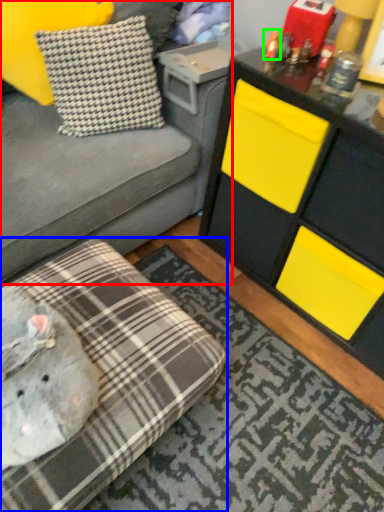
Question: Based on their relative distances, which object is farther from studio couch (highlighted by a red box)? Choose from studio couch (highlighted by a blue box) and toy (highlighted by a green box).

Choices:
 (A) studio couch
 (B) toy

Answer: (B)